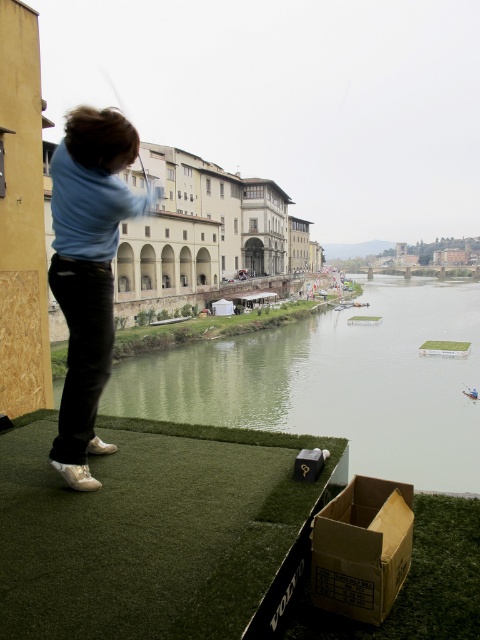
You are a golfer preparing to hit a ball. You notice the green smooth water at center and the brown cardboard box at lower right. Which object is wider?

The green smooth water at center is wider than the brown cardboard box at lower right.

The user is standing on the rooftop platform and wants to drop a small floating object into the green smooth water at center. Based on the coordinates provided in the Objects Description, where should they aim to ensure the object lands in the water?

The user should aim for the coordinates point at (x=336, y=381) to ensure the small floating object lands in the green smooth water at center.

You are standing on the rooftop platform and want to place a golf ball exactly at the point marked as point (82, 177). If you can throw the ball 5 meters, will you be able to reach that point from where you are standing?

The point (82, 177) is 4.88 meters away from the viewer. Since you can throw the ball 5 meters, you will be able to reach that point.